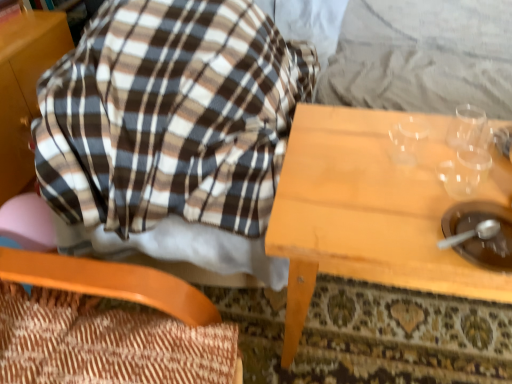
Locate an element on the screen. free point above wooden table at center (from a real-world perspective) is located at coordinates (417, 171).